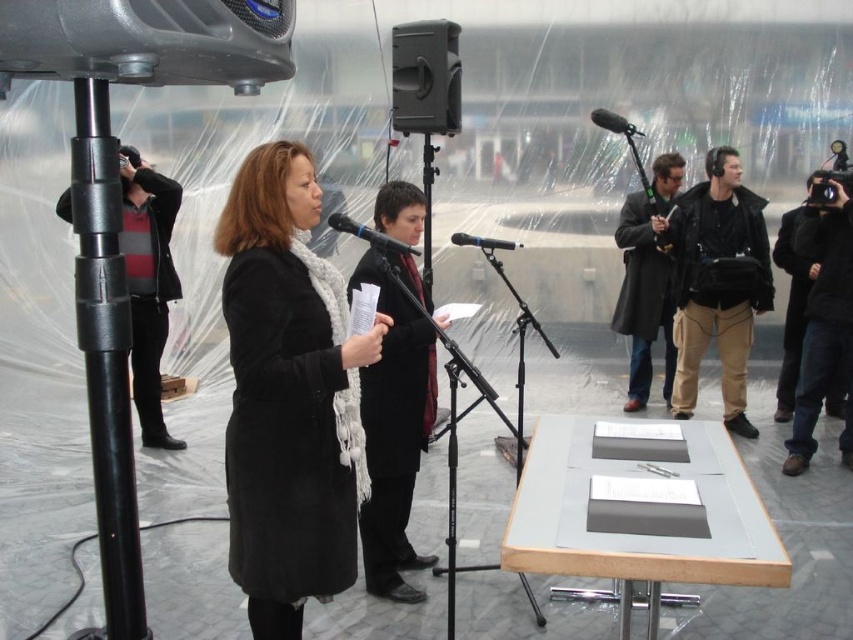
Is point (402, 560) in front of point (625, 124)?

Yes, point (402, 560) is in front of point (625, 124).

Find the location of a particular element. Image resolution: width=853 pixels, height=640 pixels. black wool coat at center is located at coordinates (393, 435).

Between point (241, 576) and point (393, 189), which one is positioned behind?

Positioned behind is point (393, 189).

Who is positioned more to the left, matte black coat at center or black wool coat at center?

From the viewer's perspective, matte black coat at center appears more on the left side.

Image resolution: width=853 pixels, height=640 pixels. I want to click on matte black coat at center, so click(289, 396).

Who is shorter, black leather jacket at right or dark gray coat at right?

dark gray coat at right

Does black leather jacket at right have a greater width compared to dark gray coat at right?

Indeed, black leather jacket at right has a greater width compared to dark gray coat at right.

Where is `black leather jacket at right`? black leather jacket at right is located at coordinates (717, 282).

The height and width of the screenshot is (640, 853). Identify the location of black leather jacket at right. (717, 282).